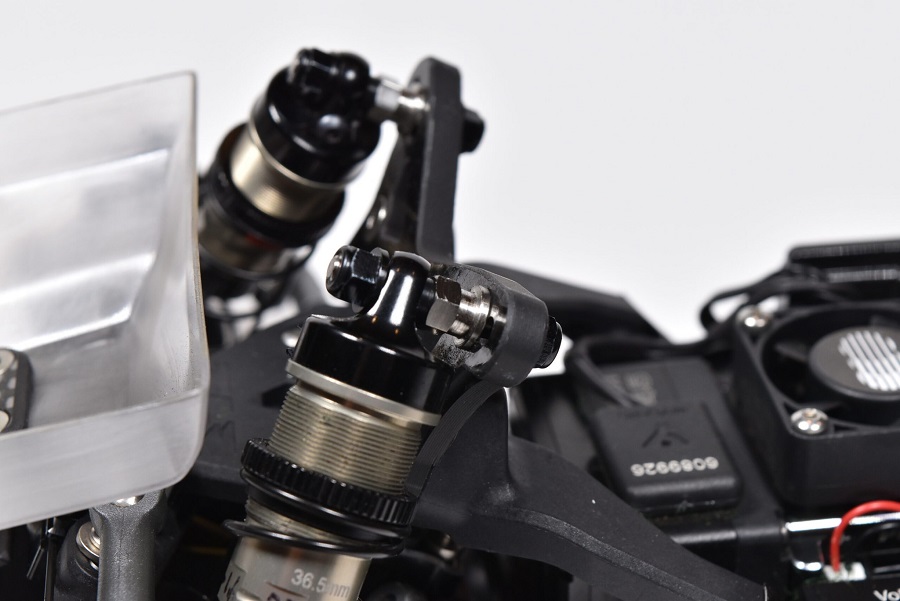
You are a GUI agent. You are given a task and a screenshot of the screen. Output one action in this format:
    pyautogui.click(x=<x>, y=<y>)
    Task: Click on the vent
    
    Given the screenshot: What is the action you would take?
    pyautogui.click(x=878, y=370)